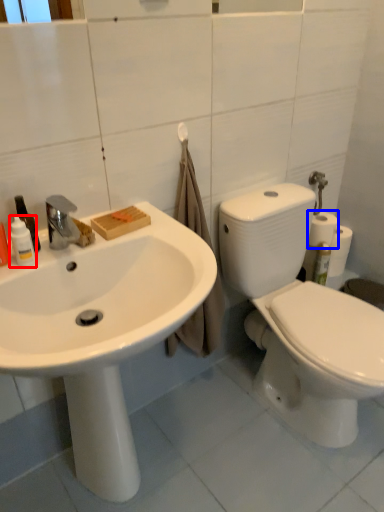
Question: Which of the following is the closest to the observer, toiletry (highlighted by a red box) or toilet paper (highlighted by a blue box)?

Choices:
 (A) toiletry
 (B) toilet paper

Answer: (A)